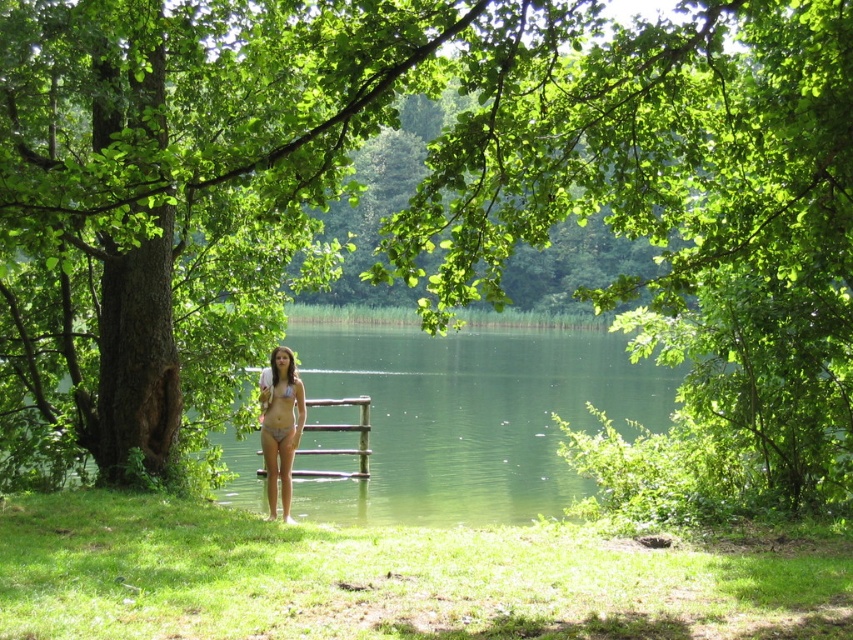
Does matte white bikini at center appear under white matte bikini at center?

Indeed, matte white bikini at center is positioned under white matte bikini at center.

Is matte white bikini at center positioned at the back of white matte bikini at center?

No.

Who is more distant from viewer, (271, 369) or (265, 426)?

Positioned behind is point (271, 369).

Find the location of `matte white bikini at center`. matte white bikini at center is located at coordinates (280, 428).

Describe the element at coordinates (279, 429) in the screenshot. I see `white matte bikini at center` at that location.

Can you confirm if white matte bikini at center is positioned below matte white bikini top at center?

Indeed, white matte bikini at center is positioned under matte white bikini top at center.

Does point (280, 435) lie in front of point (285, 396)?

Yes, it is.

Where is `white matte bikini at center`? Image resolution: width=853 pixels, height=640 pixels. white matte bikini at center is located at coordinates (279, 429).

Does matte white bikini at center have a larger size compared to matte white bikini top at center?

Yes.

Image resolution: width=853 pixels, height=640 pixels. Describe the element at coordinates (280, 428) in the screenshot. I see `matte white bikini at center` at that location.

This screenshot has height=640, width=853. I want to click on matte white bikini at center, so click(280, 428).